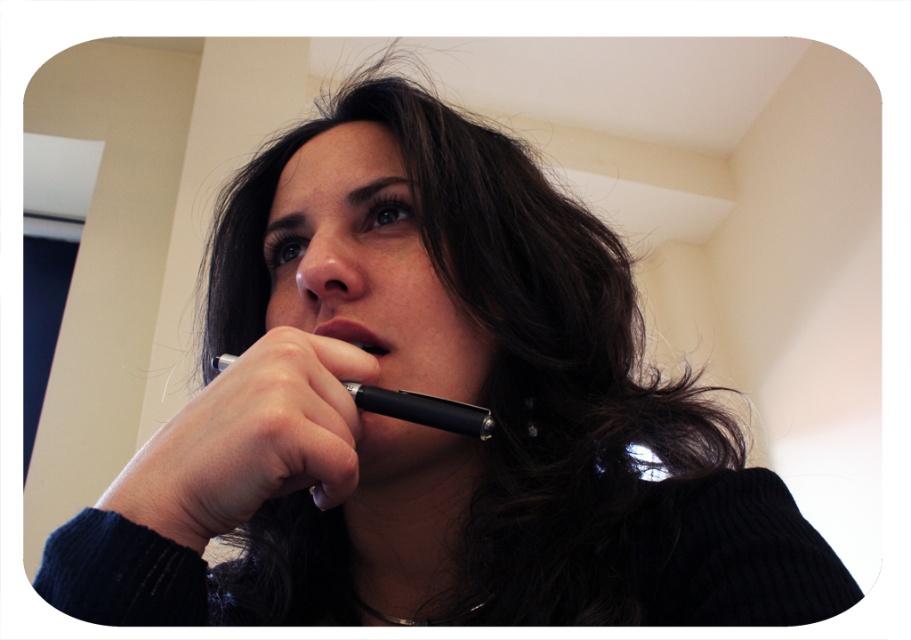
Question: Which point is closer to the camera?

Choices:
 (A) (346, 326)
 (B) (223, 356)

Answer: (B)

Question: Considering the relative positions of matte black nose at center and pink matte lips at center in the image provided, where is matte black nose at center located with respect to pink matte lips at center?

Choices:
 (A) right
 (B) left

Answer: (B)

Question: Considering the real-world distances, which object is farthest from the matte black nose at center?

Choices:
 (A) pink matte lips at center
 (B) black matte pen at lower center

Answer: (B)

Question: Estimate the real-world distances between objects in this image. Which object is farther from the black matte pen at lower center?

Choices:
 (A) matte black nose at center
 (B) pink matte lips at center

Answer: (A)

Question: Is black matte pen at lower center closer to the viewer compared to pink matte lips at center?

Choices:
 (A) no
 (B) yes

Answer: (B)

Question: Considering the relative positions of black matte pen at lower center and pink matte lips at center in the image provided, where is black matte pen at lower center located with respect to pink matte lips at center?

Choices:
 (A) above
 (B) below

Answer: (B)